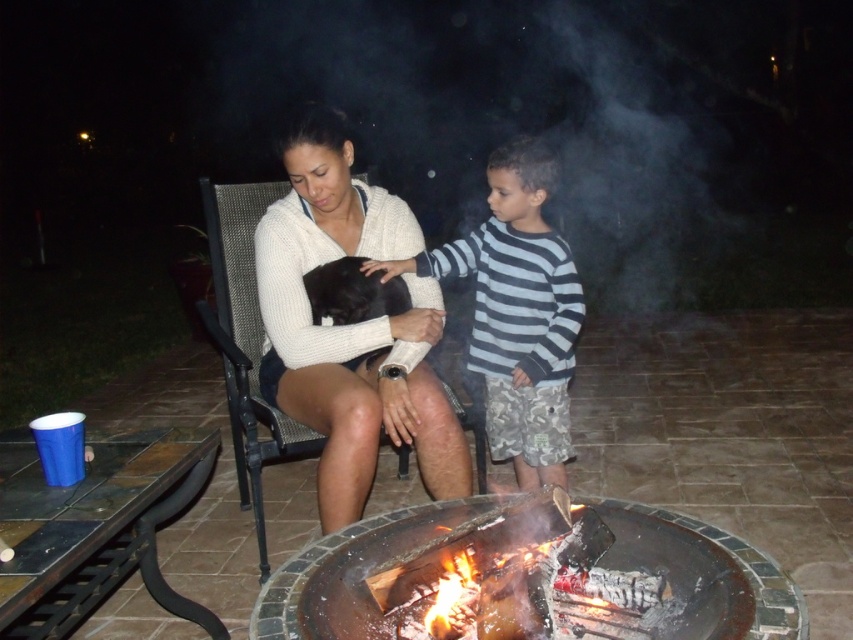
You are standing at the edge of the patio, facing the fire pit. You notice two objects at the center of the scene. Which object is positioned to the right when looking at the striped cotton shirt at center and the charcoal gray stone fire pit at center?

The striped cotton shirt at center is positioned to the right of the charcoal gray stone fire pit at center.

You are standing in the nighttime outdoor scene with a fire pit. There are two points marked in the image. The first point is at coordinates point (430, 305) and the second is at point (770, 589). Which point is closer to you?

Point (430, 305) is closer to you because it is further to the viewer than point (770, 589).

You are a photographer trying to capture a candid shot of both the white knit sweater at center and the striped cotton shirt at center. Since you want to ensure both are visible in the frame, which direction should you position your camera relative to the subjects?

The white knit sweater at center is positioned on the left side of striped cotton shirt at center, so you should position your camera to the left of the subjects to ensure both are visible in the frame.